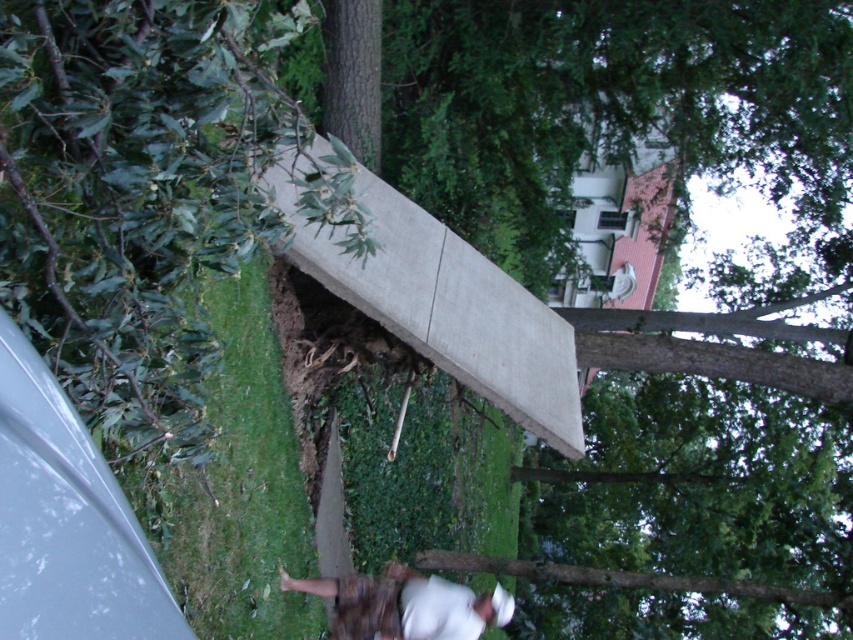
You are trying to decide whether to place a small potted plant on the green grass at lower left or the white matte skateboard at lower center. Based on their thickness, which surface would provide a more stable base for the plant?

The white matte skateboard at lower center is thicker than the green grass at lower left, so placing the plant there would provide a more stable base.

You are standing at the edge of the grassy area and want to reach the white matte skateboard at lower center. Which direction should you move to get there from the green grass at lower left?

The green grass at lower left is to the left of the white matte skateboard at lower center, so you should move to the right to reach the skateboard.